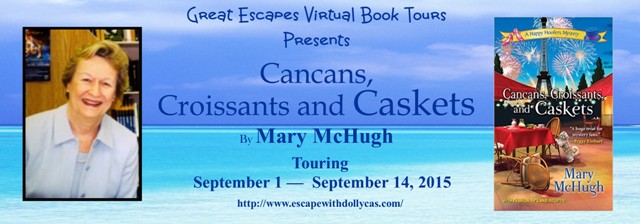
Locate an element on the screen. The height and width of the screenshot is (224, 640). portrait picture is located at coordinates (104, 144).